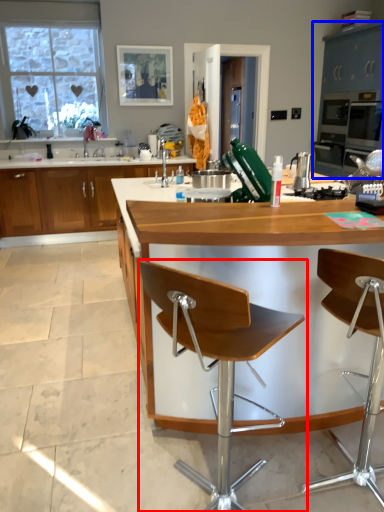
Question: Which point is further to the camera, chair (highlighted by a red box) or cabinetry (highlighted by a blue box)?

Choices:
 (A) chair
 (B) cabinetry

Answer: (B)